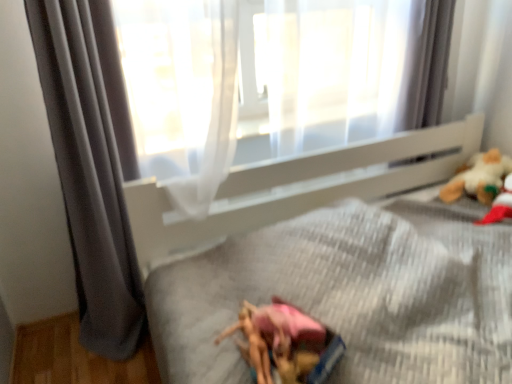
Question: Would you say gray fabric curtain at left is part of white plush bear at upper right's contents?

Choices:
 (A) yes
 (B) no

Answer: (B)

Question: Is white plush bear at upper right not within gray fabric curtain at left?

Choices:
 (A) yes
 (B) no

Answer: (A)

Question: Is white plush bear at upper right wider than gray fabric curtain at left?

Choices:
 (A) no
 (B) yes

Answer: (B)

Question: Is white plush bear at upper right far away from gray fabric curtain at left?

Choices:
 (A) yes
 (B) no

Answer: (A)

Question: Can you confirm if white plush bear at upper right is bigger than gray fabric curtain at left?

Choices:
 (A) yes
 (B) no

Answer: (B)

Question: Is the position of white plush bear at upper right more distant than that of gray fabric curtain at left?

Choices:
 (A) yes
 (B) no

Answer: (A)

Question: Can you confirm if gray fabric curtain at left is positioned to the right of white plush bear at upper right?

Choices:
 (A) no
 (B) yes

Answer: (A)

Question: Does gray fabric curtain at left have a larger size compared to white plush bear at upper right?

Choices:
 (A) no
 (B) yes

Answer: (B)

Question: Does gray fabric curtain at left have a lesser width compared to white plush bear at upper right?

Choices:
 (A) yes
 (B) no

Answer: (A)

Question: Considering the relative sizes of gray fabric curtain at left and white plush bear at upper right in the image provided, is gray fabric curtain at left shorter than white plush bear at upper right?

Choices:
 (A) no
 (B) yes

Answer: (A)

Question: Can we say gray fabric curtain at left lies outside white plush bear at upper right?

Choices:
 (A) yes
 (B) no

Answer: (A)

Question: From a real-world perspective, is gray fabric curtain at left over white plush bear at upper right?

Choices:
 (A) yes
 (B) no

Answer: (A)

Question: From a real-world perspective, relative to white plush bear at upper right, is gray fabric curtain at left vertically above or below?

Choices:
 (A) above
 (B) below

Answer: (A)